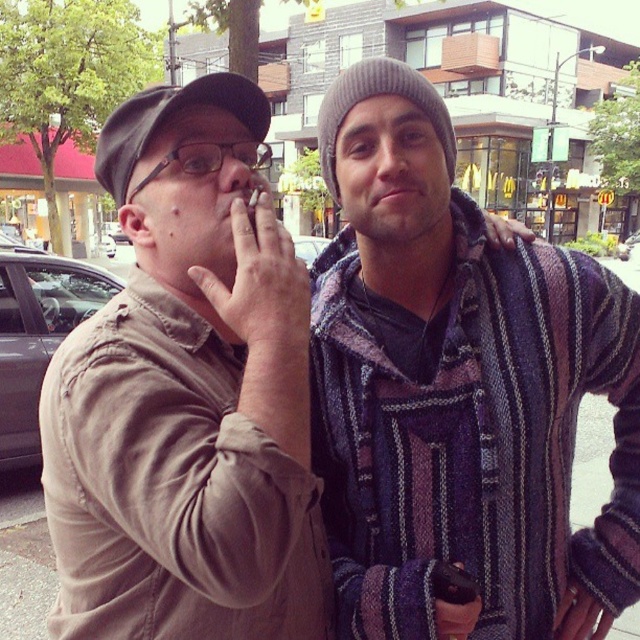
You are a photographer trying to capture both the striped woolen sweater at center and the matte khaki shirt at center in a single frame. Given that your camera has a minimum focus distance of 40 centimeters, will you be able to take the photo without moving closer or farther away?

The distance between the striped woolen sweater at center and the matte khaki shirt at center is 36.26 centimeters. Since this distance is less than the camera minimum focus distance of 40 centimeters, the photographer cannot capture both subjects in focus without adjusting their position.